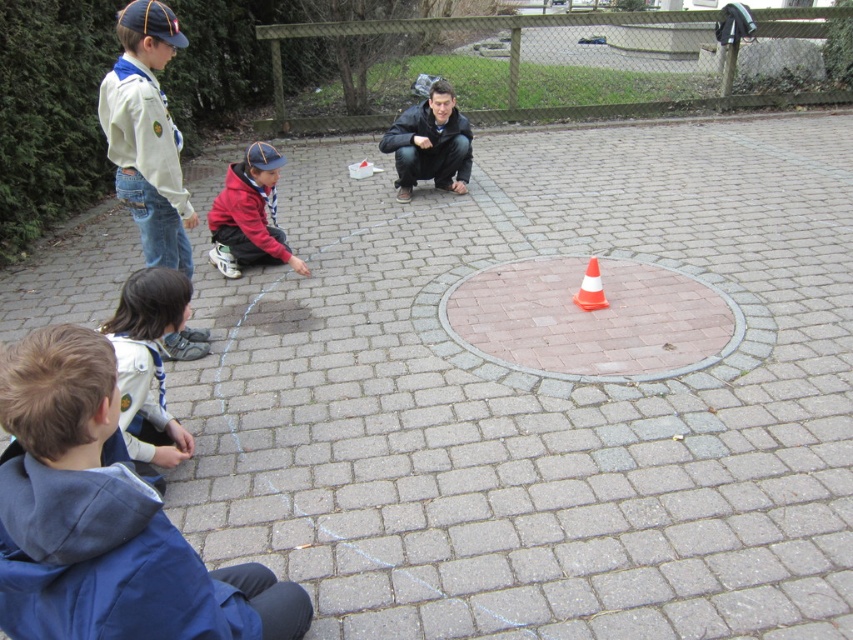
Who is positioned more to the right, blue fleece jacket at lower left or red fleece jacket at center?

blue fleece jacket at lower left

Can you confirm if blue fleece jacket at lower left is wider than red fleece jacket at center?

No, blue fleece jacket at lower left is not wider than red fleece jacket at center.

Is point (91, 368) closer to viewer compared to point (265, 260)?

Yes, point (91, 368) is in front of point (265, 260).

Locate an element on the screen. Image resolution: width=853 pixels, height=640 pixels. blue fleece jacket at lower left is located at coordinates (x=103, y=518).

Does blue fleece jacket at lower left have a larger size compared to white matte uniform at upper left?

Incorrect, blue fleece jacket at lower left is not larger than white matte uniform at upper left.

Is point (22, 586) positioned behind point (164, 184)?

No, (22, 586) is in front of (164, 184).

Find the location of `blue fleece jacket at lower left`. blue fleece jacket at lower left is located at coordinates (103, 518).

What do you see at coordinates (590, 320) in the screenshot? Image resolution: width=853 pixels, height=640 pixels. I see `pink brick circle at center` at bounding box center [590, 320].

Is pink brick circle at center taller than red fleece jacket at center?

No, pink brick circle at center is not taller than red fleece jacket at center.

Is point (482, 298) closer to camera compared to point (238, 240)?

Yes, it is in front of point (238, 240).

Identify the location of pink brick circle at center. This screenshot has height=640, width=853. point(590,320).